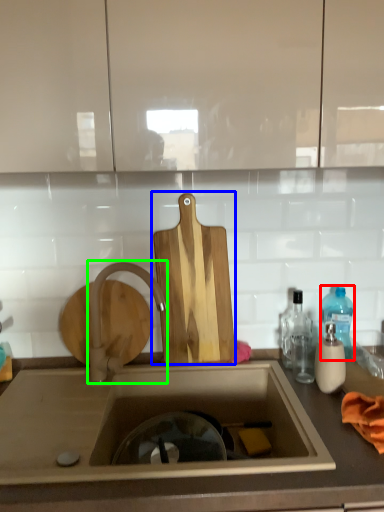
Question: Which object is the closest to the bottle (highlighted by a red box)? Choose among these: cutting board (highlighted by a blue box) or tap (highlighted by a green box).

Choices:
 (A) cutting board
 (B) tap

Answer: (A)